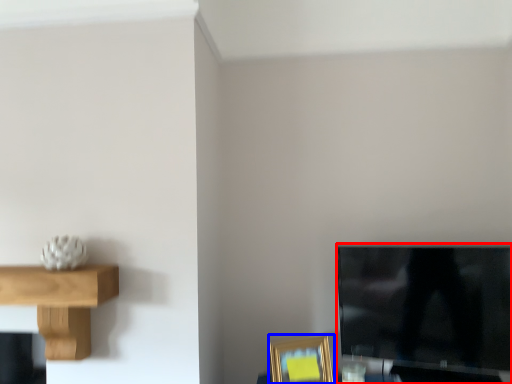
Question: Which point is closer to the camera, television (highlighted by a red box) or picture frame (highlighted by a blue box)?

Choices:
 (A) television
 (B) picture frame

Answer: (A)